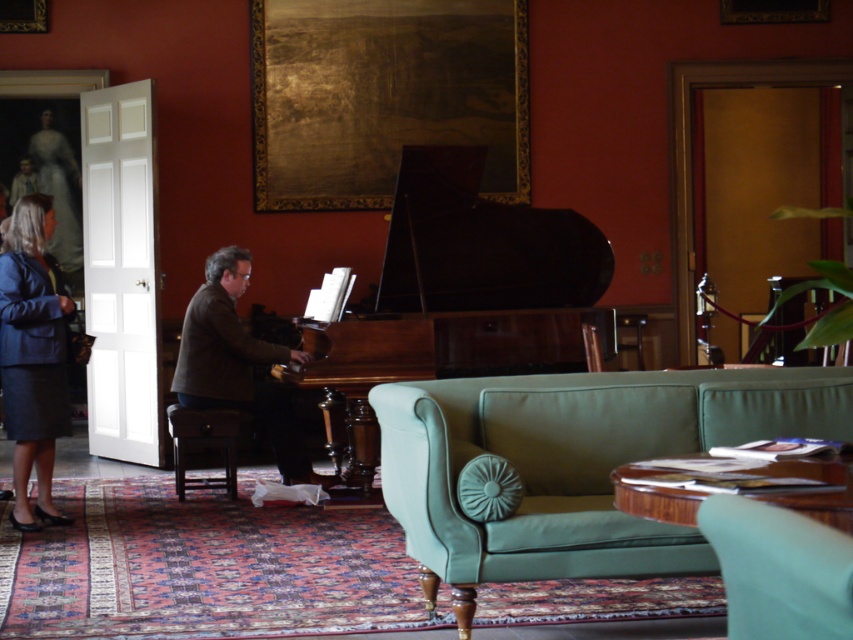
Question: Is light green leather couch at center thinner than light green fabric armchair at lower right?

Choices:
 (A) no
 (B) yes

Answer: (A)

Question: Does light green fabric armchair at lower right appear on the right side of wooden piano at center?

Choices:
 (A) no
 (B) yes

Answer: (B)

Question: Which object appears closest to the camera in this image?

Choices:
 (A) light green leather couch at center
 (B) light green fabric armchair at lower right
 (C) wooden piano at center

Answer: (B)

Question: Among these points, which one is farthest from the camera?

Choices:
 (A) (61, 340)
 (B) (514, 572)
 (C) (183, 346)
 (D) (798, 582)

Answer: (C)

Question: Is light green fabric armchair at lower right behind wooden piano at center?

Choices:
 (A) no
 (B) yes

Answer: (A)

Question: Which point is farther to the camera?

Choices:
 (A) pos(171,419)
 (B) pos(308,323)
 (C) pos(457,534)
 (D) pos(20,435)

Answer: (B)